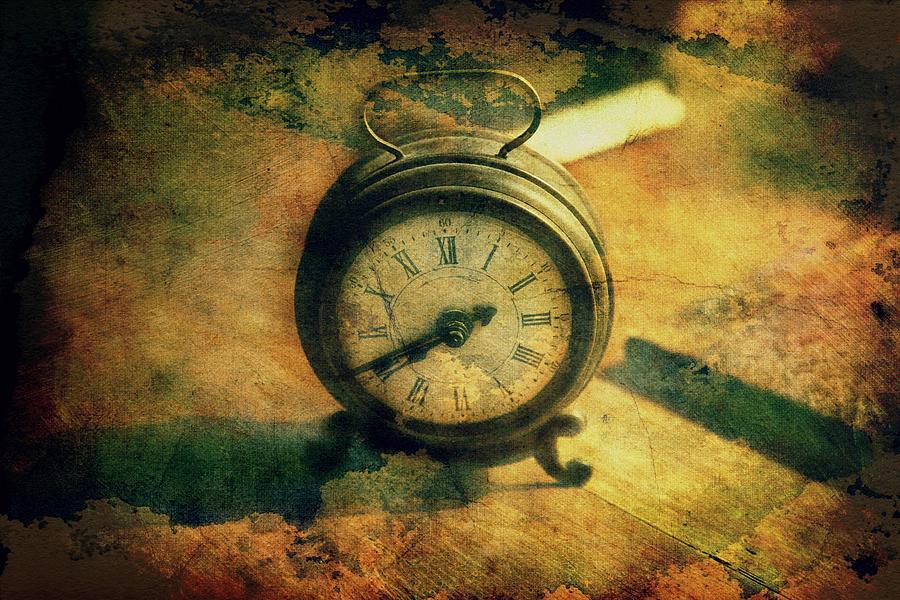
What are the coordinates of `black minute hand of alarm clock` in the screenshot? It's located at (381, 358).